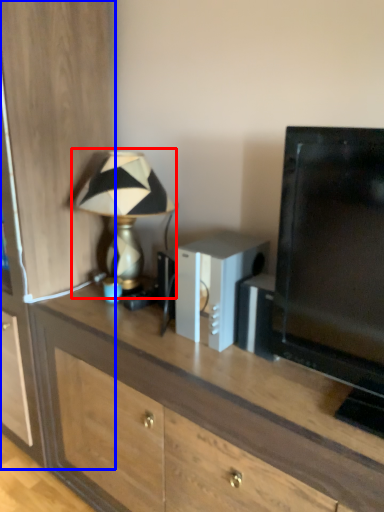
Question: Which object is further to the camera taking this photo, lamp (highlighted by a red box) or cabinetry (highlighted by a blue box)?

Choices:
 (A) lamp
 (B) cabinetry

Answer: (A)